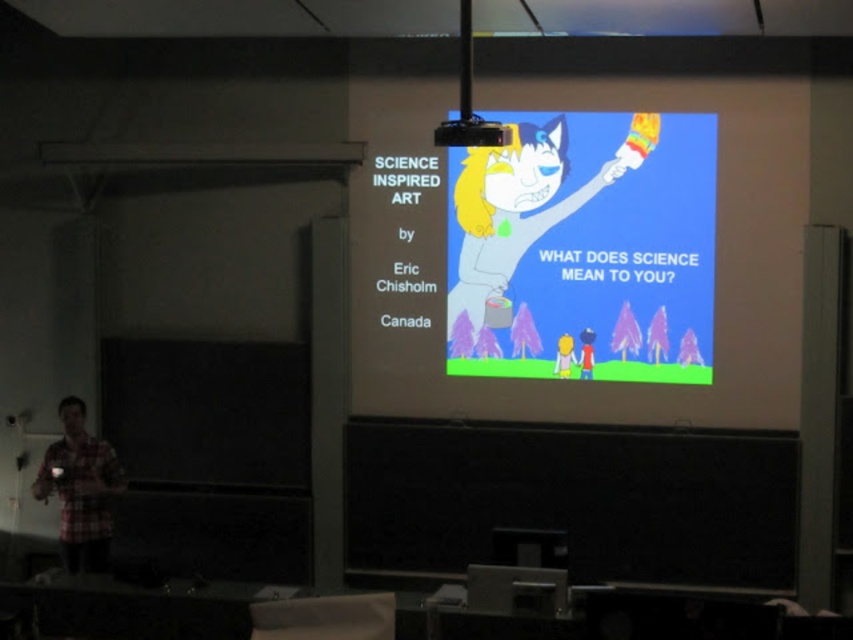
You are sitting in the audience facing the screen. There are two points marked on the slide. The first point is at coordinate point [660,323] and the second is at point [456,144]. Which point appears closer to you?

Point [660,323] is further to the camera than point [456,144], so the second point is closer to you.